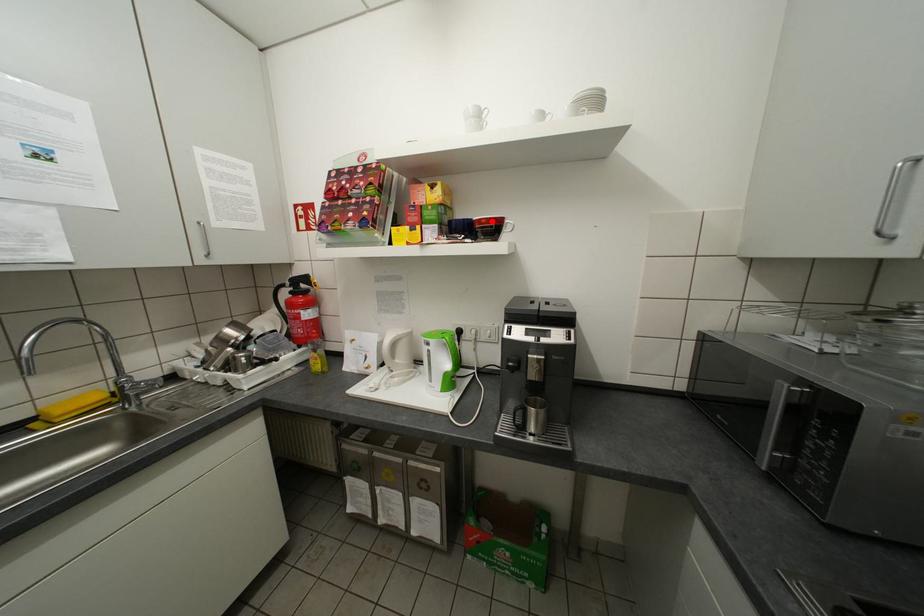
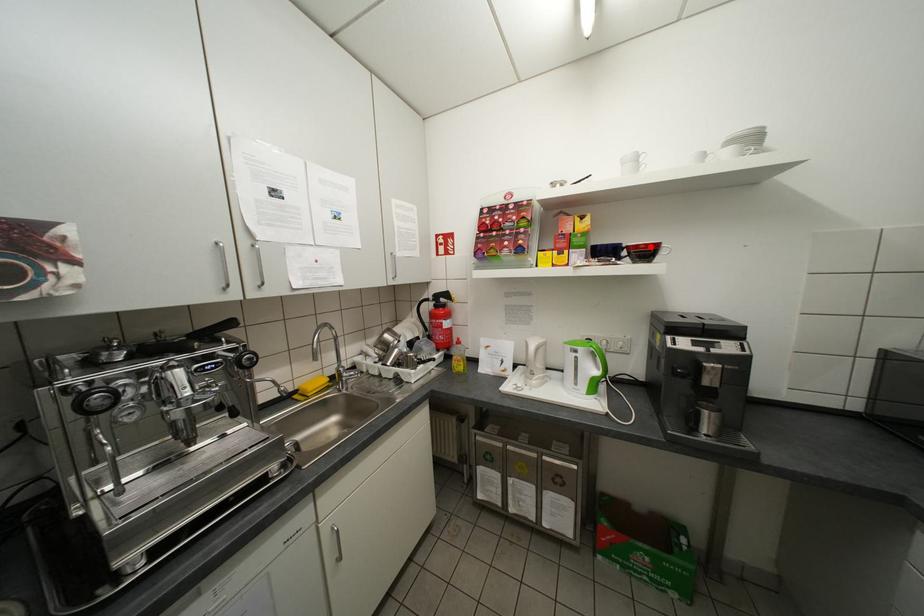
I am providing you with two images of the same scene from different viewpoints. A red point is marked on the first image and another point is marked on the second image. Is the red point in image1 aligned with the point shown in image2?

Yes